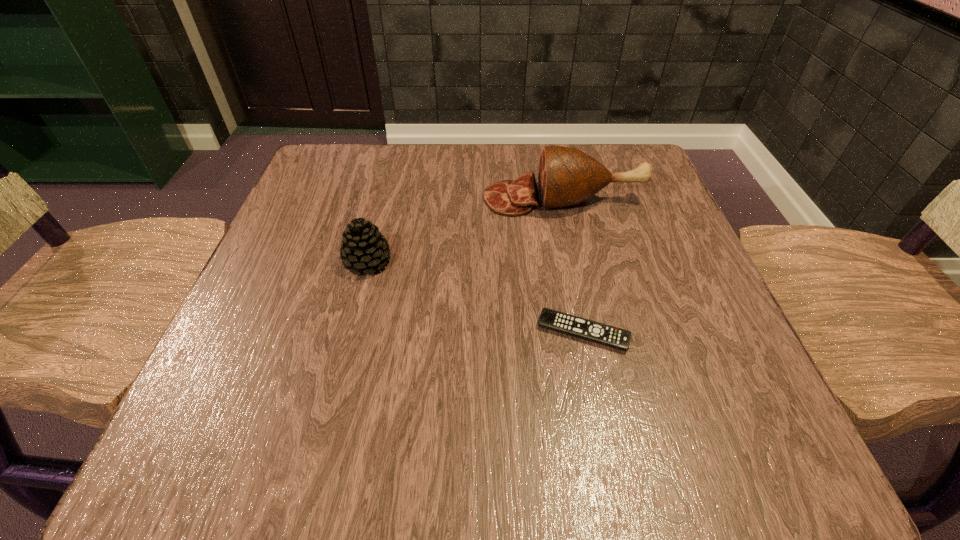
At what (x,y) coordinates should I click in order to perform the action: click on vacant space that is in between the farthest object and the second farthest object. Please return your answer as a coordinate pair (x, y). The height and width of the screenshot is (540, 960). Looking at the image, I should click on (466, 230).

Point out which object is positioned as the second nearest to the nearest object. Please provide its 2D coordinates. Your answer should be formatted as a tuple, i.e. [(x, y)], where the tuple contains the x and y coordinates of a point satisfying the conditions above.

[(363, 247)]

Identify which object is the second closest to the remote control. Please provide its 2D coordinates. Your answer should be formatted as a tuple, i.e. [(x, y)], where the tuple contains the x and y coordinates of a point satisfying the conditions above.

[(363, 247)]

Where is `free spot that satisfies the following two spatial constraints: 1. at the narrow end of the shortest object; 2. on the right side of the second shortest object`? The image size is (960, 540). free spot that satisfies the following two spatial constraints: 1. at the narrow end of the shortest object; 2. on the right side of the second shortest object is located at coordinates (349, 332).

At what (x,y) coordinates should I click in order to perform the action: click on free space that satisfies the following two spatial constraints: 1. at the narrow end of the remote control; 2. on the right side of the second shortest object. Please return your answer as a coordinate pair (x, y). Looking at the image, I should click on (349, 332).

Image resolution: width=960 pixels, height=540 pixels. Identify the location of free location that satisfies the following two spatial constraints: 1. at the sliced end of the farthest object; 2. on the front side of the shortest object. (593, 332).

Locate an element on the screen. The image size is (960, 540). free location that satisfies the following two spatial constraints: 1. at the narrow end of the remote control; 2. on the left side of the second farthest object is located at coordinates (349, 332).